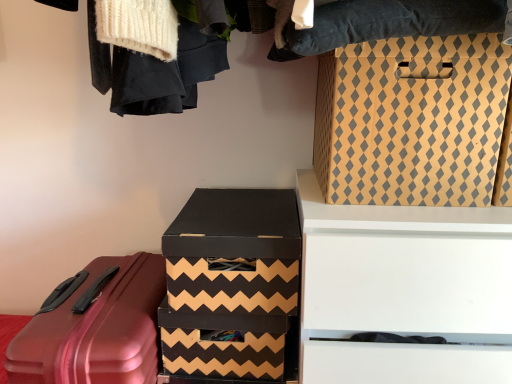
Question: Should I look upward or downward to see shiny red suitcase at lower left?

Choices:
 (A) down
 (B) up

Answer: (A)

Question: Which direction should I rotate to face brown zigzag-patterned box at center, positioned as the first box in bottom-to-top order, — up or down?

Choices:
 (A) down
 (B) up

Answer: (A)

Question: Considering the relative positions of shiny red suitcase at lower left and black cardboard box at center, marked as the 2th box in a bottom-to-top arrangement, in the image provided, is shiny red suitcase at lower left behind black cardboard box at center, marked as the 2th box in a bottom-to-top arrangement,?

Choices:
 (A) yes
 (B) no

Answer: (B)

Question: Considering the relative sizes of shiny red suitcase at lower left and black cardboard box at center, the second box from the top, in the image provided, is shiny red suitcase at lower left bigger than black cardboard box at center, the second box from the top,?

Choices:
 (A) yes
 (B) no

Answer: (A)

Question: Is shiny red suitcase at lower left smaller than black cardboard box at center, marked as the 2th box in a bottom-to-top arrangement?

Choices:
 (A) yes
 (B) no

Answer: (B)

Question: Considering the relative positions of shiny red suitcase at lower left and black cardboard box at center, the second box from the top, in the image provided, is shiny red suitcase at lower left to the left of black cardboard box at center, the second box from the top, from the viewer's perspective?

Choices:
 (A) yes
 (B) no

Answer: (A)

Question: Is shiny red suitcase at lower left thinner than black cardboard box at center, marked as the 2th box in a bottom-to-top arrangement?

Choices:
 (A) yes
 (B) no

Answer: (B)

Question: From a real-world perspective, is shiny red suitcase at lower left over black cardboard box at center, the second box from the top?

Choices:
 (A) yes
 (B) no

Answer: (B)

Question: Can you confirm if white matte drawer at upper right is taller than shiny red suitcase at lower left?

Choices:
 (A) no
 (B) yes

Answer: (B)

Question: From the image's perspective, is white matte drawer at upper right beneath shiny red suitcase at lower left?

Choices:
 (A) yes
 (B) no

Answer: (B)

Question: Does white matte drawer at upper right have a greater width compared to shiny red suitcase at lower left?

Choices:
 (A) yes
 (B) no

Answer: (B)

Question: Is white matte drawer at upper right thinner than shiny red suitcase at lower left?

Choices:
 (A) yes
 (B) no

Answer: (A)

Question: Does white matte drawer at upper right come behind shiny red suitcase at lower left?

Choices:
 (A) no
 (B) yes

Answer: (A)

Question: From a real-world perspective, does white matte drawer at upper right stand above shiny red suitcase at lower left?

Choices:
 (A) yes
 (B) no

Answer: (A)

Question: Would you say shiny red suitcase at lower left contains white matte drawer at upper right?

Choices:
 (A) no
 (B) yes

Answer: (A)